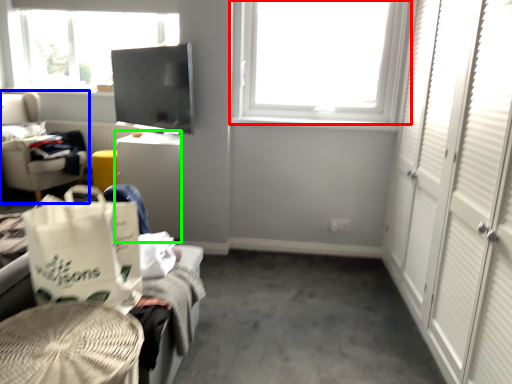
Question: Which object is the closest to the window (highlighted by a red box)? Choose among these: chair (highlighted by a blue box) or desk (highlighted by a green box).

Choices:
 (A) chair
 (B) desk

Answer: (B)